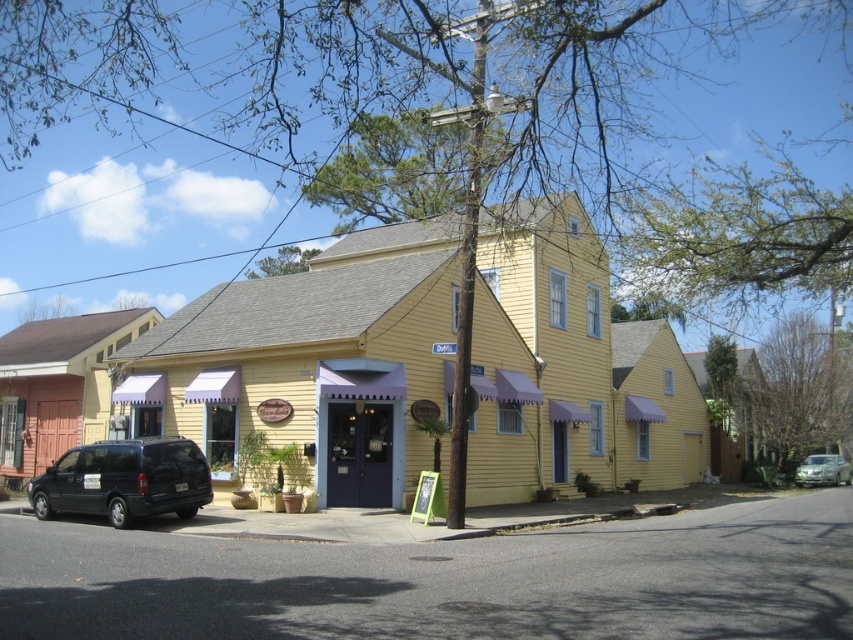
Question: From the image, what is the correct spatial relationship of matte black van at lower left in relation to metallic silver sedan at lower right?

Choices:
 (A) right
 (B) left

Answer: (B)

Question: Can you confirm if matte black van at lower left is positioned below metallic silver sedan at lower right?

Choices:
 (A) yes
 (B) no

Answer: (B)

Question: Which of the following is the closest to the observer?

Choices:
 (A) [814, 456]
 (B) [88, 499]

Answer: (B)

Question: Is matte black van at lower left to the left of metallic silver sedan at lower right from the viewer's perspective?

Choices:
 (A) yes
 (B) no

Answer: (A)